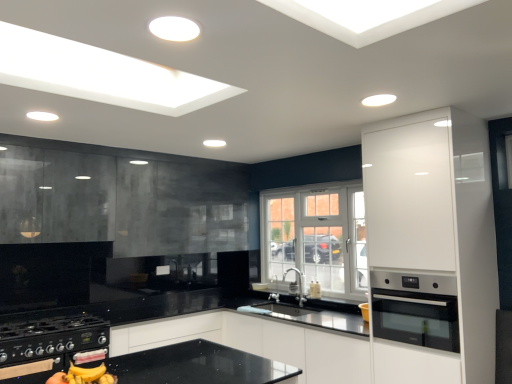
Question: Is white glossy cabinet at right, acting as the first cabinetry starting from the right, completely or partially outside of black glass cabinet at upper left, which is the 1th cabinetry in left-to-right order?

Choices:
 (A) no
 (B) yes

Answer: (B)

Question: Can you confirm if white glossy cabinet at right, acting as the first cabinetry starting from the right, is taller than black glass cabinet at upper left, which is the 1th cabinetry in left-to-right order?

Choices:
 (A) yes
 (B) no

Answer: (A)

Question: Considering the relative positions of white glossy cabinet at right, which is the second cabinetry in back-to-front order, and black glass cabinet at upper left, which is the first cabinetry from back to front, in the image provided, is white glossy cabinet at right, which is the second cabinetry in back-to-front order, to the left of black glass cabinet at upper left, which is the first cabinetry from back to front, from the viewer's perspective?

Choices:
 (A) yes
 (B) no

Answer: (B)

Question: Does white glossy cabinet at right, acting as the first cabinetry starting from the right, have a greater width compared to black glass cabinet at upper left, the 2th cabinetry from the front?

Choices:
 (A) yes
 (B) no

Answer: (A)

Question: Is black glass cabinet at upper left, acting as the second cabinetry starting from the right, a part of white glossy cabinet at right, the 2th cabinetry positioned from the left?

Choices:
 (A) no
 (B) yes

Answer: (A)

Question: From a real-world perspective, is white glossy cabinet at right, acting as the first cabinetry starting from the right, beneath black glass cabinet at upper left, the 2th cabinetry from the front?

Choices:
 (A) no
 (B) yes

Answer: (B)

Question: Can you confirm if black glass cabinet at upper left, the 2th cabinetry from the front, is thinner than satin nickel faucet at center?

Choices:
 (A) yes
 (B) no

Answer: (B)

Question: Are black glass cabinet at upper left, which is the 1th cabinetry in left-to-right order, and satin nickel faucet at center making contact?

Choices:
 (A) no
 (B) yes

Answer: (A)

Question: Is black glass cabinet at upper left, the 2th cabinetry from the front, positioned far away from satin nickel faucet at center?

Choices:
 (A) yes
 (B) no

Answer: (A)

Question: Is satin nickel faucet at center at the back of black glass cabinet at upper left, which is the first cabinetry from back to front?

Choices:
 (A) yes
 (B) no

Answer: (B)

Question: Considering the relative sizes of black glass cabinet at upper left, which is the first cabinetry from back to front, and satin nickel faucet at center in the image provided, is black glass cabinet at upper left, which is the first cabinetry from back to front, shorter than satin nickel faucet at center?

Choices:
 (A) yes
 (B) no

Answer: (B)

Question: From the image's perspective, is black glass cabinet at upper left, the 2th cabinetry from the front, on satin nickel faucet at center?

Choices:
 (A) no
 (B) yes

Answer: (B)

Question: Is satin nickel faucet at center further to the viewer compared to stainless steel oven at right?

Choices:
 (A) no
 (B) yes

Answer: (B)